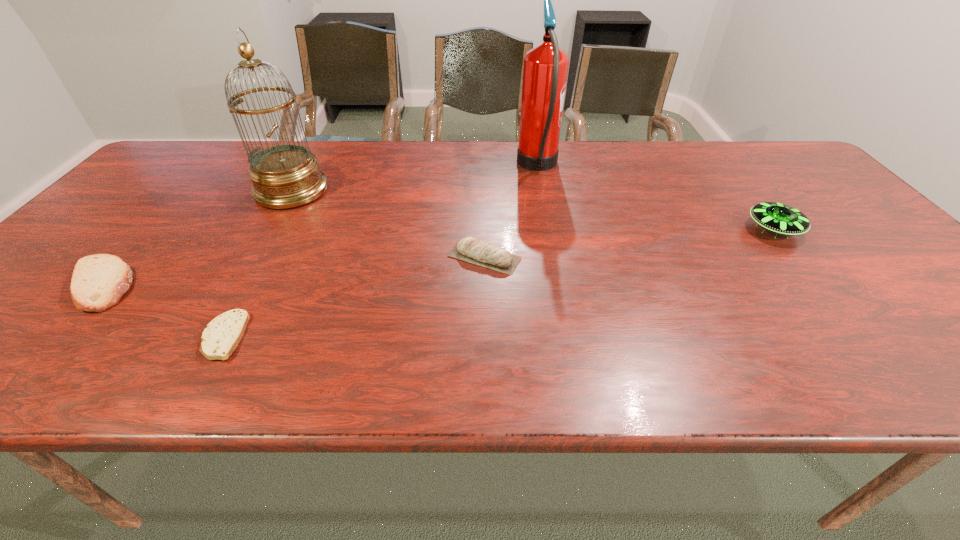
Locate an element on the screen. free region at the near edge of the desktop is located at coordinates (197, 364).

In the image, there is a desktop. Where is `free region at the left edge`? free region at the left edge is located at coordinates (148, 185).

This screenshot has width=960, height=540. Identify the location of vacant region at the right edge of the desktop. (785, 187).

Where is `unoccupied area between the shortest pita bread and the fifth tallest object`? The width and height of the screenshot is (960, 540). unoccupied area between the shortest pita bread and the fifth tallest object is located at coordinates (162, 310).

Find the location of a particular element. The width and height of the screenshot is (960, 540). free spot between the shortest pita bread and the fire extinguisher is located at coordinates [381, 252].

Identify the location of vacant area that lies between the fifth object from left to right and the birdcage. (415, 179).

Find the location of a particular element. The height and width of the screenshot is (540, 960). free spot between the fourth shortest object and the shortest object is located at coordinates (498, 283).

Where is `empty space between the shortest pita bread and the second shortest object`? The width and height of the screenshot is (960, 540). empty space between the shortest pita bread and the second shortest object is located at coordinates (162, 310).

At what (x,y) coordinates should I click in order to perform the action: click on free space between the shortest pita bread and the second shortest object. Please return your answer as a coordinate pair (x, y). This screenshot has height=540, width=960. Looking at the image, I should click on (162, 310).

Find the location of a particular element. The width and height of the screenshot is (960, 540). free space between the birdcage and the second tallest pita bread is located at coordinates (196, 238).